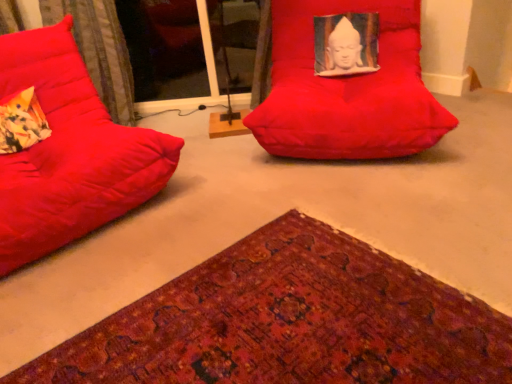
Question: Is the position of matte red bean bag at left, the 2th furniture when ordered from right to left, more distant than that of velvet-like fabric at left?

Choices:
 (A) no
 (B) yes

Answer: (A)

Question: Is matte red bean bag at left, which ranks as the first furniture in left-to-right order, not close to velvet-like fabric at left?

Choices:
 (A) yes
 (B) no

Answer: (B)

Question: Is matte red bean bag at left, the 2th furniture when ordered from right to left, wider than velvet-like fabric at left?

Choices:
 (A) yes
 (B) no

Answer: (A)

Question: From the image's perspective, is matte red bean bag at left, the 2th furniture when ordered from right to left, located above velvet-like fabric at left?

Choices:
 (A) yes
 (B) no

Answer: (B)

Question: From a real-world perspective, does matte red bean bag at left, the 2th furniture when ordered from right to left, sit lower than velvet-like fabric at left?

Choices:
 (A) yes
 (B) no

Answer: (A)

Question: Considering the positions of floral fabric pillow at left and textured woolen mat at lower left in the image, is floral fabric pillow at left taller or shorter than textured woolen mat at lower left?

Choices:
 (A) short
 (B) tall

Answer: (B)

Question: From a real-world perspective, is floral fabric pillow at left positioned above or below textured woolen mat at lower left?

Choices:
 (A) below
 (B) above

Answer: (B)

Question: Visually, is floral fabric pillow at left positioned to the left or to the right of textured woolen mat at lower left?

Choices:
 (A) left
 (B) right

Answer: (A)

Question: Is floral fabric pillow at left spatially inside textured woolen mat at lower left, or outside of it?

Choices:
 (A) outside
 (B) inside

Answer: (A)

Question: Considering the positions of matte red bean bag at left, which ranks as the first furniture in left-to-right order, and transparent glass door at upper center in the image, is matte red bean bag at left, which ranks as the first furniture in left-to-right order, wider or thinner than transparent glass door at upper center?

Choices:
 (A) wide
 (B) thin

Answer: (A)

Question: Based on their positions, is matte red bean bag at left, the 2th furniture when ordered from right to left, located to the left or right of transparent glass door at upper center?

Choices:
 (A) left
 (B) right

Answer: (A)

Question: Looking at the image, does matte red bean bag at left, the 2th furniture when ordered from right to left, seem bigger or smaller compared to transparent glass door at upper center?

Choices:
 (A) big
 (B) small

Answer: (A)

Question: Is point (53, 231) closer or farther from the camera than point (186, 84)?

Choices:
 (A) closer
 (B) farther

Answer: (A)

Question: Do you think matte red bean bag at left, the 2th furniture when ordered from right to left, is within matte red beanbag at center, which is the 1th furniture from right to left, or outside of it?

Choices:
 (A) outside
 (B) inside

Answer: (A)

Question: Looking at the image, does matte red bean bag at left, which ranks as the first furniture in left-to-right order, seem bigger or smaller compared to matte red beanbag at center, positioned as the 2th furniture in left-to-right order?

Choices:
 (A) big
 (B) small

Answer: (B)